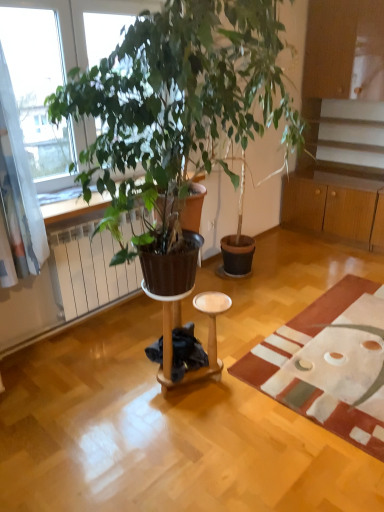
Question: Are wooden side table at center and brown matte radiator at left located far from each other?

Choices:
 (A) yes
 (B) no

Answer: (B)

Question: Is wooden side table at center aimed at brown matte radiator at left?

Choices:
 (A) yes
 (B) no

Answer: (B)

Question: Can you confirm if wooden side table at center is wider than brown matte radiator at left?

Choices:
 (A) no
 (B) yes

Answer: (B)

Question: Is wooden side table at center shorter than brown matte radiator at left?

Choices:
 (A) no
 (B) yes

Answer: (B)

Question: Is brown matte radiator at left surrounded by wooden side table at center?

Choices:
 (A) yes
 (B) no

Answer: (B)

Question: From the image's perspective, is wooden cabinet at right located above or below wooden side table at center?

Choices:
 (A) above
 (B) below

Answer: (A)

Question: From a real-world perspective, relative to wooden side table at center, is wooden cabinet at right vertically above or below?

Choices:
 (A) below
 (B) above

Answer: (B)

Question: From their relative heights in the image, would you say wooden cabinet at right is taller or shorter than wooden side table at center?

Choices:
 (A) short
 (B) tall

Answer: (B)

Question: Is wooden cabinet at right in front of or behind wooden side table at center in the image?

Choices:
 (A) front
 (B) behind

Answer: (B)

Question: Is wooden side table at center in front of or behind textured beige rug at lower right in the image?

Choices:
 (A) front
 (B) behind

Answer: (B)

Question: In terms of size, does wooden side table at center appear bigger or smaller than textured beige rug at lower right?

Choices:
 (A) small
 (B) big

Answer: (A)

Question: From a real-world perspective, relative to textured beige rug at lower right, is wooden side table at center vertically above or below?

Choices:
 (A) below
 (B) above

Answer: (B)

Question: Considering the positions of wooden side table at center and textured beige rug at lower right in the image, is wooden side table at center taller or shorter than textured beige rug at lower right?

Choices:
 (A) tall
 (B) short

Answer: (A)

Question: From the image's perspective, is wooden side table at center positioned above or below wooden cabinet at right?

Choices:
 (A) above
 (B) below

Answer: (B)

Question: From a real-world perspective, is wooden side table at center above or below wooden cabinet at right?

Choices:
 (A) above
 (B) below

Answer: (B)